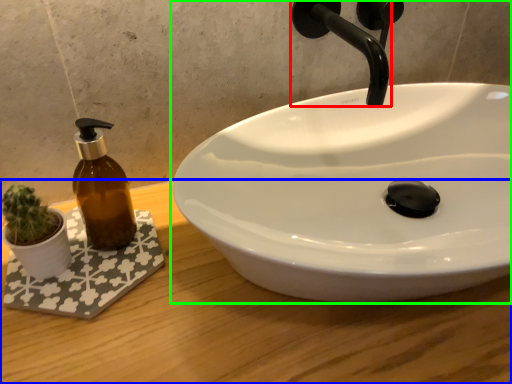
Question: Considering the real-world distances, which object is closest to tap (highlighted by a red box)? counter top (highlighted by a blue box) or sink (highlighted by a green box).

Choices:
 (A) counter top
 (B) sink

Answer: (B)